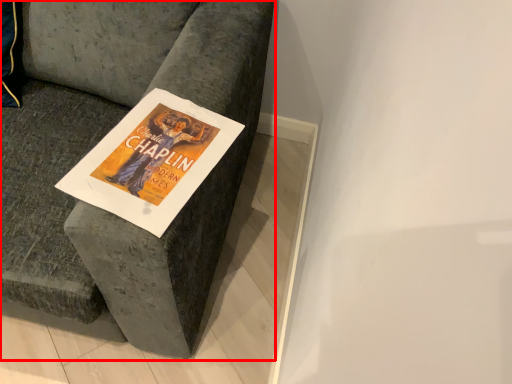
Question: From the image's perspective, what is the correct spatial relationship of furniture (annotated by the red box) in relation to magazine?

Choices:
 (A) below
 (B) above

Answer: (B)